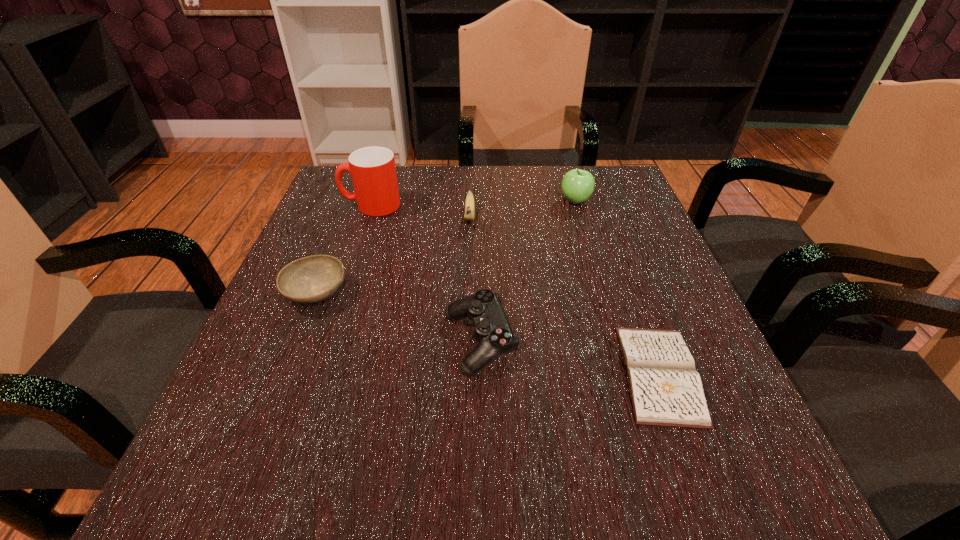
You are a GUI agent. You are given a task and a screenshot of the screen. Output one action in this format:
    pyautogui.click(x=<x>, y=<y>)
    Task: Click on the free location that satisfies the following two spatial constraints: 1. on the front side of the diary; 2. on the left side of the control
    
    Given the screenshot: What is the action you would take?
    pyautogui.click(x=480, y=374)